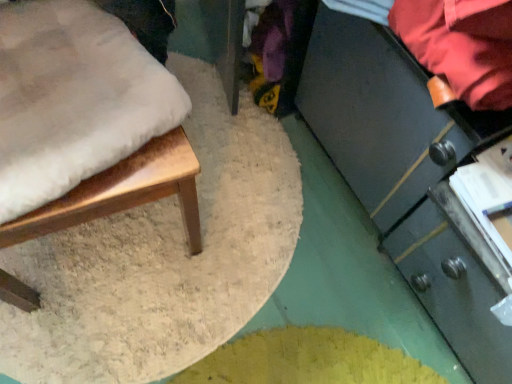
You are a GUI agent. You are given a task and a screenshot of the screen. Output one action in this format:
    pyautogui.click(x=<x>, y=<y>)
    Task: Click on the empty space that is ontop of soft white cushion at left
    The image size is (512, 384).
    Given the screenshot: What is the action you would take?
    (x=78, y=121)